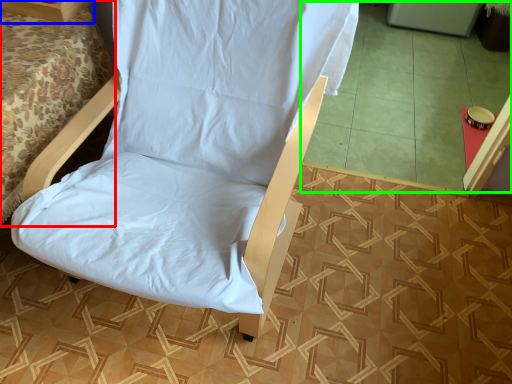
Question: Considering the real-world distances, which object is closest to bed (highlighted by a red box)? furniture (highlighted by a blue box) or tile (highlighted by a green box).

Choices:
 (A) furniture
 (B) tile

Answer: (A)